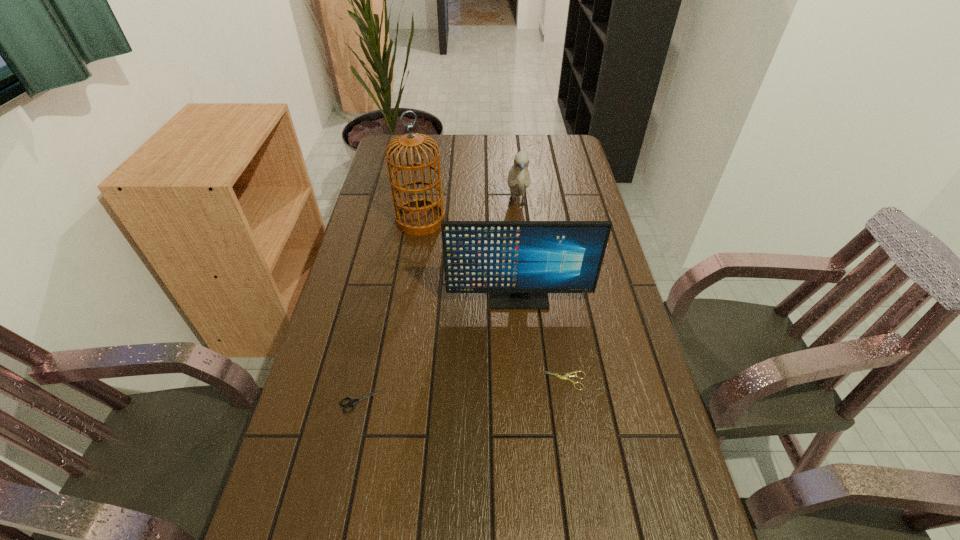
The image size is (960, 540). I want to click on birdcage, so click(421, 216).

At what (x,y) coordinates should I click in order to perform the action: click on the third farthest object. Please return your answer as a coordinate pair (x, y). Looking at the image, I should click on (518, 262).

Where is `the fourth shortest object`? This screenshot has height=540, width=960. the fourth shortest object is located at coordinates [x=518, y=262].

I want to click on bird, so click(518, 177).

Identify the location of the taller shears. (352, 402).

Find the location of a particular element. the fourth tallest object is located at coordinates (352, 402).

Find the location of a particular element. the shortest object is located at coordinates (564, 377).

Image resolution: width=960 pixels, height=540 pixels. I want to click on the right shears, so click(x=564, y=377).

The height and width of the screenshot is (540, 960). I want to click on vacant region located 0.080m on the right of the tallest object, so click(468, 220).

In order to click on free point located 0.280m on the screen side of the fourth shortest object in this screenshot , I will do `click(527, 403)`.